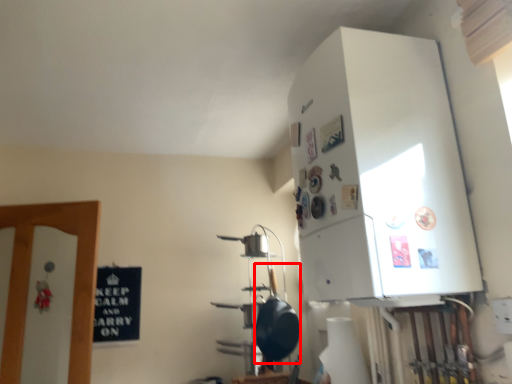
Question: From the image's perspective, what is the correct spatial positioning of wok (annotated by the red box) in reference to appliance?

Choices:
 (A) below
 (B) above

Answer: (A)